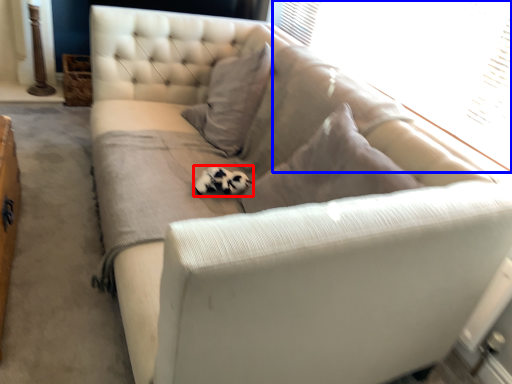
Question: Which object is further to the camera taking this photo, animal (highlighted by a red box) or window screen (highlighted by a blue box)?

Choices:
 (A) animal
 (B) window screen

Answer: (A)